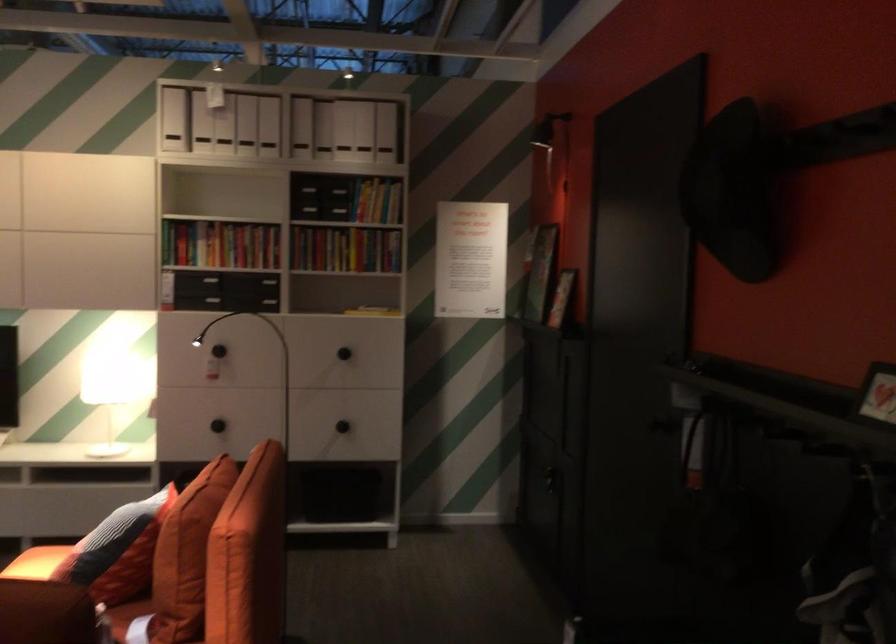
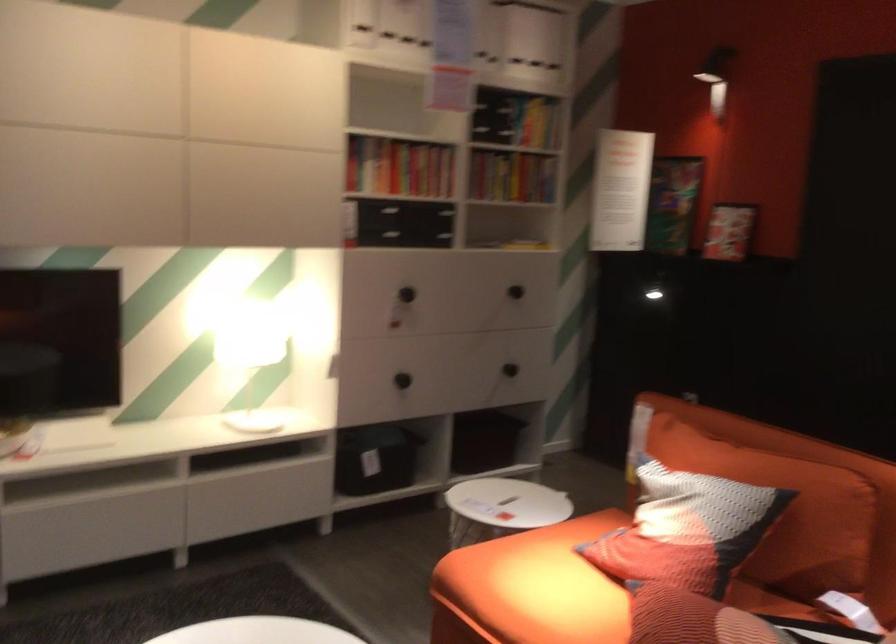
Where in the second image is the point corresponding to the point at 328,258 from the first image?

(512, 176)